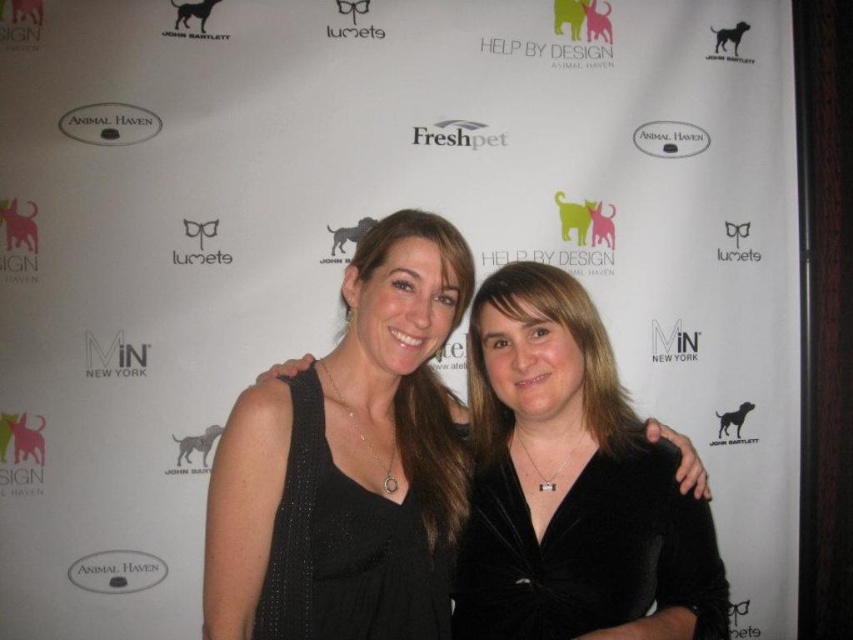
You are standing in front of the image and want to touch the two points mentioned. Which point, point (x=241, y=500) or point (x=497, y=582), would feel closer to your hand when you reach out?

Point (x=241, y=500) is closer to the viewer than point (x=497, y=582), so it would feel closer to your hand when you reach out.

In the scene shown: You are a fashion designer trying to create a new collection inspired by the image. You want to place two black dresses side by side on a runway. The velvet black dress at center and the black textured dress at center. Given that the runway is 2 meters wide, will both dresses fit side by side without overlapping?

The velvet black dress at center is 22.75 centimeters away from the black textured dress at center. Since the runway is 2 meters wide, which is 200 centimeters, there is sufficient space to place both dresses side by side without overlapping.

You are a fashion designer measuring the distance between two black dresses in the image. The dresses are labeled as the black velvet dress at center and the velvet black dress at center. According to the description, how far apart are these two dresses?

The black velvet dress at center and the velvet black dress at center are 9.55 inches apart from each other.